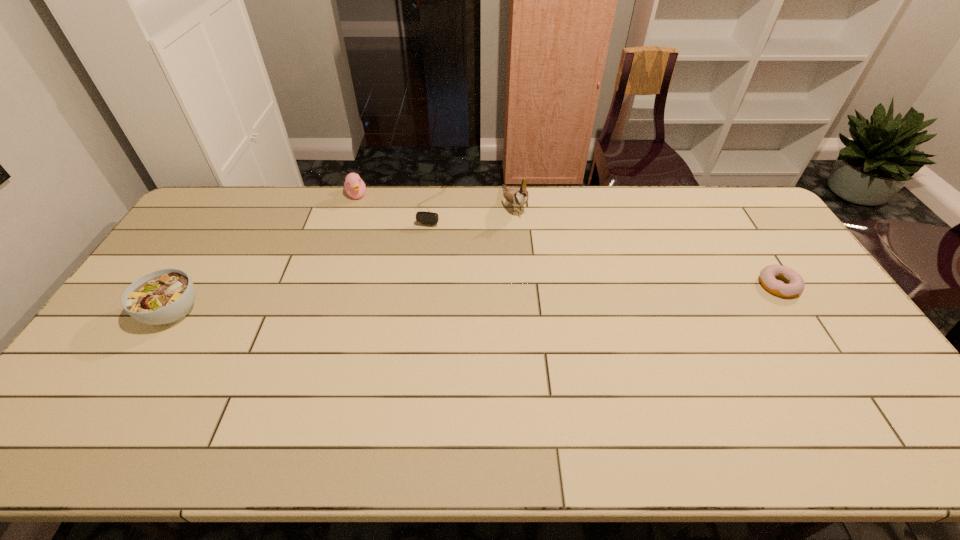
This screenshot has width=960, height=540. I want to click on object that stands as the third closest to the leftmost object, so click(518, 197).

This screenshot has height=540, width=960. Find the location of `free space that satisfies the following two spatial constraints: 1. on the back side of the leftmost object; 2. on the left side of the webcam`. free space that satisfies the following two spatial constraints: 1. on the back side of the leftmost object; 2. on the left side of the webcam is located at coordinates (238, 207).

Locate an element on the screen. free space that satisfies the following two spatial constraints: 1. on the front side of the bird; 2. on the right side of the duckling is located at coordinates (353, 205).